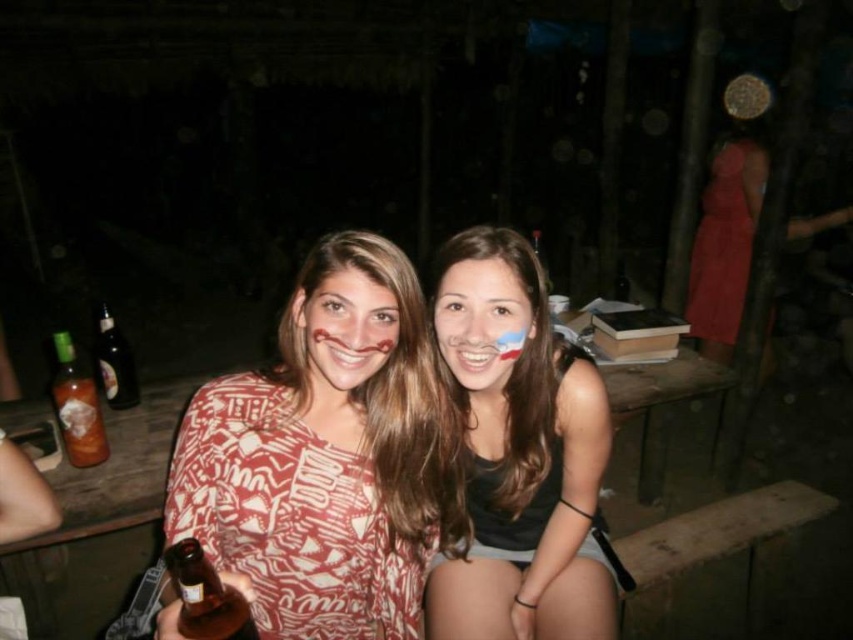
Question: Where is matte black tank top at center located in relation to translucent glass bottle at lower left in the image?

Choices:
 (A) below
 (B) above

Answer: (A)

Question: Is matte black tank top at center to the left of dark glass bottle at left from the viewer's perspective?

Choices:
 (A) yes
 (B) no

Answer: (B)

Question: Among these points, which one is nearest to the camera?

Choices:
 (A) (111, 346)
 (B) (563, 572)
 (C) (219, 392)
 (D) (235, 620)

Answer: (D)

Question: Which point appears closest to the camera in this image?

Choices:
 (A) (495, 394)
 (B) (187, 624)
 (C) (480, 280)

Answer: (B)

Question: Estimate the real-world distances between objects in this image. Which object is farther from the matte red face at center?

Choices:
 (A) brown glass bottle at lower left
 (B) matte skin face at center
 (C) translucent glass bottle at lower left
 (D) matte black tank top at center

Answer: (C)

Question: Is matte red dress at center smaller than dark glass bottle at left?

Choices:
 (A) yes
 (B) no

Answer: (B)